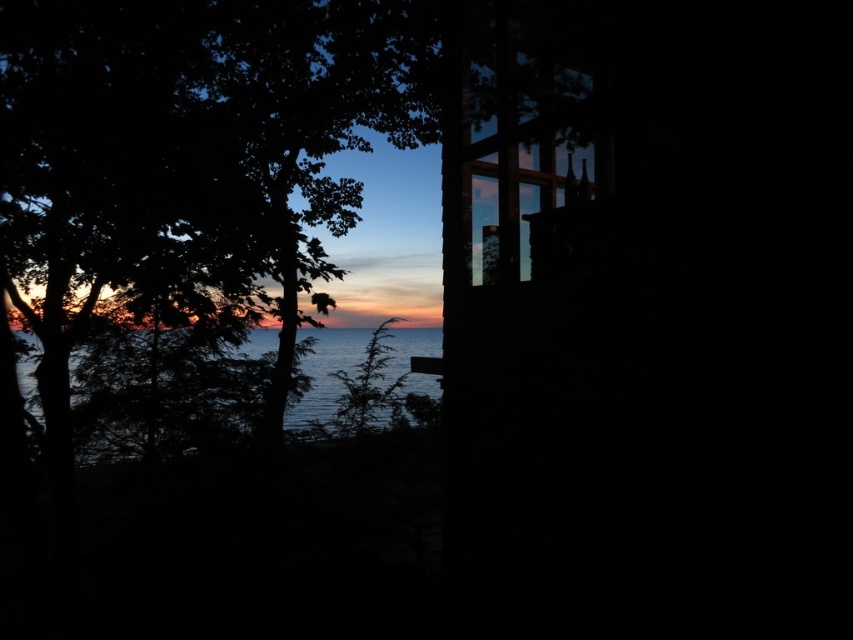
You are an architect designing a new house. You want to ensure that the transparent glass window at center provides a clear view of the blue water at left. Based on the scene, can you confirm if the window is positioned in a way that allows this view?

The transparent glass window at center is above the blue water at left, so it is positioned to provide a clear view of the blue water at left as described.

You are an architect designing a new house. You want to ensure that the transparent glass window at center allows a clear view of the dark green leafy tree at left from inside the house. Based on the scene description, will the window provide enough space to see the entire tree?

The dark green leafy tree at left might be wider than the transparent glass window at center, so there is a possibility that the window may not be wide enough to show the entire tree from inside the house.

You are standing at the point closest to the window frame in the cabin scene. There are two points marked in the image, point A at coordinates point A is point (300, 10) and point B at coordinates point B is point (318, 396). Which point is closer to you?

Point A at coordinates point (300, 10) is closer to you because it is in front of point B at coordinates point (318, 396).